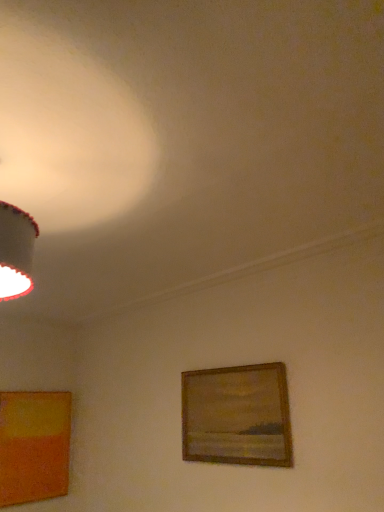
What is the approximate width of wooden picture frame at center, which is the second picture frame from back to front?

The width of wooden picture frame at center, which is the second picture frame from back to front, is 1.48 inches.

What do you see at coordinates (237, 416) in the screenshot?
I see `wooden picture frame at center, which ranks as the 1th picture frame in right-to-left order` at bounding box center [237, 416].

Identify the location of wooden picture frame at center, which ranks as the 1th picture frame in right-to-left order. Image resolution: width=384 pixels, height=512 pixels. (237, 416).

Locate an element on the screen. matte orange picture frame at lower left, the second picture frame in the right-to-left sequence is located at coordinates (34, 446).

Describe the element at coordinates (34, 446) in the screenshot. I see `matte orange picture frame at lower left, which appears as the 2th picture frame when viewed from the front` at that location.

The width and height of the screenshot is (384, 512). I want to click on wooden picture frame at center, which appears as the second picture frame when viewed from the left, so click(x=237, y=416).

Is matte orange picture frame at lower left, the second picture frame in the right-to-left sequence, to the left or to the right of wooden picture frame at center, which is the second picture frame from back to front, in the image?

In the image, matte orange picture frame at lower left, the second picture frame in the right-to-left sequence, appears on the left side of wooden picture frame at center, which is the second picture frame from back to front.

In the image, is matte orange picture frame at lower left, the second picture frame in the right-to-left sequence, positioned in front of or behind wooden picture frame at center, which ranks as the 1th picture frame in right-to-left order?

matte orange picture frame at lower left, the second picture frame in the right-to-left sequence, is positioned farther from the viewer than wooden picture frame at center, which ranks as the 1th picture frame in right-to-left order.

Does point (66, 449) come farther from viewer compared to point (251, 378)?

Yes, point (66, 449) is behind point (251, 378).

From the image's perspective, which one is positioned lower, matte orange picture frame at lower left, which appears as the 2th picture frame when viewed from the front, or wooden picture frame at center, which ranks as the 1th picture frame in right-to-left order?

From the image's view, matte orange picture frame at lower left, which appears as the 2th picture frame when viewed from the front, is below.

In the scene shown: From a real-world perspective, is matte orange picture frame at lower left, which is the 1th picture frame from left to right, physically located above or below wooden picture frame at center, which appears as the second picture frame when viewed from the left?

matte orange picture frame at lower left, which is the 1th picture frame from left to right, is situated lower than wooden picture frame at center, which appears as the second picture frame when viewed from the left, in the real world.

Is matte orange picture frame at lower left, which is the 1th picture frame in back-to-front order, wider or thinner than wooden picture frame at center, which is the second picture frame from back to front?

In the image, matte orange picture frame at lower left, which is the 1th picture frame in back-to-front order, appears to be wider than wooden picture frame at center, which is the second picture frame from back to front.

Considering the sizes of matte orange picture frame at lower left, which is the 1th picture frame in back-to-front order, and wooden picture frame at center, which is the second picture frame from back to front, in the image, is matte orange picture frame at lower left, which is the 1th picture frame in back-to-front order, taller or shorter than wooden picture frame at center, which is the second picture frame from back to front,?

matte orange picture frame at lower left, which is the 1th picture frame in back-to-front order, is taller than wooden picture frame at center, which is the second picture frame from back to front.

Based on their sizes in the image, would you say matte orange picture frame at lower left, which appears as the 2th picture frame when viewed from the front, is bigger or smaller than wooden picture frame at center, which appears as the second picture frame when viewed from the left?

matte orange picture frame at lower left, which appears as the 2th picture frame when viewed from the front, is bigger than wooden picture frame at center, which appears as the second picture frame when viewed from the left.

Is wooden picture frame at center, the first picture frame when ordered from front to back, surrounded by matte orange picture frame at lower left, the second picture frame in the right-to-left sequence?

No, wooden picture frame at center, the first picture frame when ordered from front to back, is not inside matte orange picture frame at lower left, the second picture frame in the right-to-left sequence.

Is matte orange picture frame at lower left, the second picture frame in the right-to-left sequence, next to wooden picture frame at center, which appears as the second picture frame when viewed from the left?

matte orange picture frame at lower left, the second picture frame in the right-to-left sequence, is not next to wooden picture frame at center, which appears as the second picture frame when viewed from the left, and they're not touching.

Is matte orange picture frame at lower left, which appears as the 2th picture frame when viewed from the front, aimed at wooden picture frame at center, the first picture frame when ordered from front to back?

Yes, matte orange picture frame at lower left, which appears as the 2th picture frame when viewed from the front, is oriented towards wooden picture frame at center, the first picture frame when ordered from front to back.

How different are the orientations of matte orange picture frame at lower left, which is the 1th picture frame in back-to-front order, and wooden picture frame at center, which is the second picture frame from back to front, in degrees?

There is a 91.2-degree angle between the facing directions of matte orange picture frame at lower left, which is the 1th picture frame in back-to-front order, and wooden picture frame at center, which is the second picture frame from back to front.

Measure the distance from matte orange picture frame at lower left, which is the 1th picture frame from left to right, to wooden picture frame at center, which ranks as the 1th picture frame in right-to-left order.

5.09 feet.

At what (x,y) coordinates should I click in order to perform the action: click on picture frame located above the matte orange picture frame at lower left, the second picture frame in the right-to-left sequence (from a real-world perspective). Please return your answer as a coordinate pair (x, y). The height and width of the screenshot is (512, 384). Looking at the image, I should click on (237, 416).

Is wooden picture frame at center, which ranks as the 1th picture frame in right-to-left order, to the left or to the right of matte orange picture frame at lower left, which is the 1th picture frame from left to right, in the image?

Clearly, wooden picture frame at center, which ranks as the 1th picture frame in right-to-left order, is on the right of matte orange picture frame at lower left, which is the 1th picture frame from left to right, in the image.

Considering their positions, is wooden picture frame at center, which ranks as the 1th picture frame in right-to-left order, located in front of or behind matte orange picture frame at lower left, the second picture frame in the right-to-left sequence?

wooden picture frame at center, which ranks as the 1th picture frame in right-to-left order, is in front of matte orange picture frame at lower left, the second picture frame in the right-to-left sequence.

Which is closer to the camera, [226,402] or [25,468]?

The point [226,402] is closer to the camera.

From the image's perspective, is wooden picture frame at center, the first picture frame when ordered from front to back, on matte orange picture frame at lower left, which appears as the 2th picture frame when viewed from the front?

Correct, wooden picture frame at center, the first picture frame when ordered from front to back, appears higher than matte orange picture frame at lower left, which appears as the 2th picture frame when viewed from the front, in the image.

From a real-world perspective, does wooden picture frame at center, which appears as the second picture frame when viewed from the left, sit lower than matte orange picture frame at lower left, which is the 1th picture frame in back-to-front order?

Actually, wooden picture frame at center, which appears as the second picture frame when viewed from the left, is physically above matte orange picture frame at lower left, which is the 1th picture frame in back-to-front order, in the real world.

In terms of width, does wooden picture frame at center, which ranks as the 1th picture frame in right-to-left order, look wider or thinner when compared to matte orange picture frame at lower left, which appears as the 2th picture frame when viewed from the front?

wooden picture frame at center, which ranks as the 1th picture frame in right-to-left order, is thinner than matte orange picture frame at lower left, which appears as the 2th picture frame when viewed from the front.

Considering the sizes of objects wooden picture frame at center, which is the second picture frame from back to front, and matte orange picture frame at lower left, the second picture frame in the right-to-left sequence, in the image provided, who is shorter, wooden picture frame at center, which is the second picture frame from back to front, or matte orange picture frame at lower left, the second picture frame in the right-to-left sequence,?

wooden picture frame at center, which is the second picture frame from back to front.

Based on their sizes in the image, would you say wooden picture frame at center, which ranks as the 1th picture frame in right-to-left order, is bigger or smaller than matte orange picture frame at lower left, which is the 1th picture frame from left to right?

wooden picture frame at center, which ranks as the 1th picture frame in right-to-left order, is smaller than matte orange picture frame at lower left, which is the 1th picture frame from left to right.

Is wooden picture frame at center, which is the second picture frame from back to front, spatially inside matte orange picture frame at lower left, which appears as the 2th picture frame when viewed from the front, or outside of it?

wooden picture frame at center, which is the second picture frame from back to front, is spatially situated outside matte orange picture frame at lower left, which appears as the 2th picture frame when viewed from the front.

Would you consider wooden picture frame at center, which ranks as the 1th picture frame in right-to-left order, to be distant from matte orange picture frame at lower left, which appears as the 2th picture frame when viewed from the front?

Indeed, wooden picture frame at center, which ranks as the 1th picture frame in right-to-left order, is not near matte orange picture frame at lower left, which appears as the 2th picture frame when viewed from the front.

Is wooden picture frame at center, which ranks as the 1th picture frame in right-to-left order, oriented away from matte orange picture frame at lower left, which is the 1th picture frame in back-to-front order?

No, wooden picture frame at center, which ranks as the 1th picture frame in right-to-left order, is not facing away from matte orange picture frame at lower left, which is the 1th picture frame in back-to-front order.

Can you tell me how much wooden picture frame at center, which appears as the second picture frame when viewed from the left, and matte orange picture frame at lower left, the second picture frame in the right-to-left sequence, differ in facing direction?

91.2 degrees separate the facing orientations of wooden picture frame at center, which appears as the second picture frame when viewed from the left, and matte orange picture frame at lower left, the second picture frame in the right-to-left sequence.

How far apart are wooden picture frame at center, which ranks as the 1th picture frame in right-to-left order, and matte orange picture frame at lower left, which is the 1th picture frame in back-to-front order?

wooden picture frame at center, which ranks as the 1th picture frame in right-to-left order, is 5.09 feet from matte orange picture frame at lower left, which is the 1th picture frame in back-to-front order.

The height and width of the screenshot is (512, 384). What are the coordinates of `picture frame located underneath the wooden picture frame at center, which is the second picture frame from back to front (from a real-world perspective)` in the screenshot? It's located at (34, 446).

Image resolution: width=384 pixels, height=512 pixels. Identify the location of picture frame that appears below the wooden picture frame at center, the first picture frame when ordered from front to back (from a real-world perspective). (34, 446).

The height and width of the screenshot is (512, 384). Find the location of `picture frame below the wooden picture frame at center, the first picture frame when ordered from front to back (from the image's perspective)`. picture frame below the wooden picture frame at center, the first picture frame when ordered from front to back (from the image's perspective) is located at coordinates (34, 446).